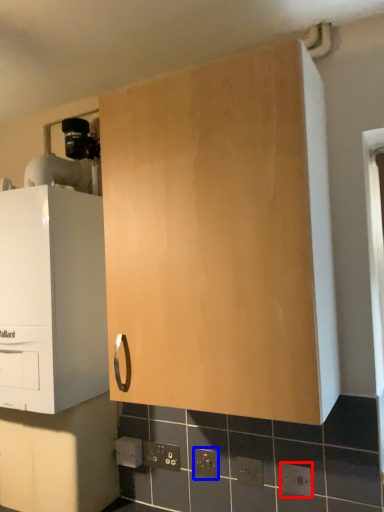
Question: Among these objects, which one is farthest to the camera, electric outlet (highlighted by a red box) or electric outlet (highlighted by a blue box)?

Choices:
 (A) electric outlet
 (B) electric outlet

Answer: (B)